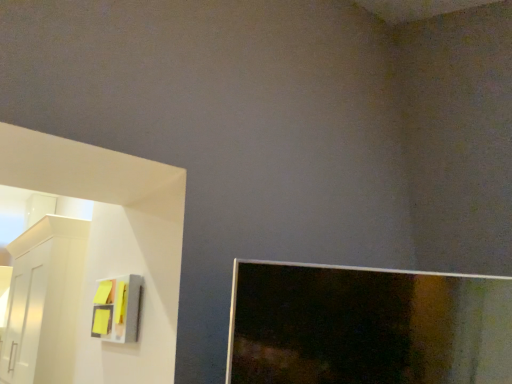
Question: Should I look upward or downward to see yellow sticky notes at left?

Choices:
 (A) up
 (B) down

Answer: (B)

Question: Does yellow sticky notes at left have a lesser width compared to white glossy cabinet at left?

Choices:
 (A) no
 (B) yes

Answer: (B)

Question: Is the depth of yellow sticky notes at left greater than that of white glossy cabinet at left?

Choices:
 (A) no
 (B) yes

Answer: (A)

Question: Is the position of yellow sticky notes at left less distant than that of white glossy cabinet at left?

Choices:
 (A) yes
 (B) no

Answer: (A)

Question: Is yellow sticky notes at left taller than white glossy cabinet at left?

Choices:
 (A) no
 (B) yes

Answer: (A)

Question: Does yellow sticky notes at left have a greater width compared to white glossy cabinet at left?

Choices:
 (A) no
 (B) yes

Answer: (A)

Question: Is yellow sticky notes at left looking in the opposite direction of white glossy cabinet at left?

Choices:
 (A) yes
 (B) no

Answer: (B)

Question: Is white glossy cabinet at left taller than yellow sticky notes at left?

Choices:
 (A) yes
 (B) no

Answer: (A)

Question: From the image's perspective, is white glossy cabinet at left under yellow sticky notes at left?

Choices:
 (A) yes
 (B) no

Answer: (A)

Question: From a real-world perspective, is white glossy cabinet at left on yellow sticky notes at left?

Choices:
 (A) no
 (B) yes

Answer: (B)

Question: Is white glossy cabinet at left wider than yellow sticky notes at left?

Choices:
 (A) yes
 (B) no

Answer: (A)

Question: Can you confirm if white glossy cabinet at left is smaller than yellow sticky notes at left?

Choices:
 (A) no
 (B) yes

Answer: (A)

Question: Is white glossy cabinet at left oriented away from yellow sticky notes at left?

Choices:
 (A) yes
 (B) no

Answer: (B)

Question: Is yellow sticky notes at left spatially inside white glossy cabinet at left, or outside of it?

Choices:
 (A) inside
 (B) outside

Answer: (B)